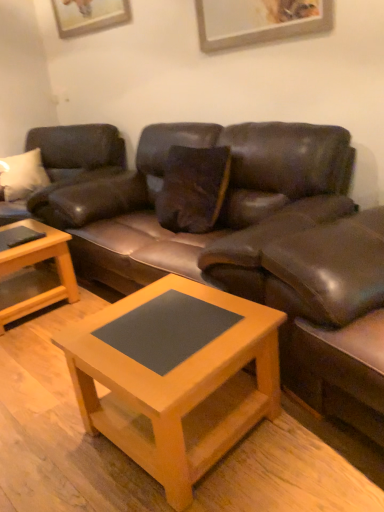
What do you see at coordinates (177, 388) in the screenshot? I see `matte wood coffee table at center, the first coffee table viewed from the right` at bounding box center [177, 388].

Locate an element on the screen. This screenshot has width=384, height=512. leather swivel chair at right is located at coordinates click(333, 317).

Image resolution: width=384 pixels, height=512 pixels. I want to click on matte wood coffee table at center, the second coffee table viewed from the left, so click(x=177, y=388).

From the image's perspective, would you say matte brown leather couch at left, acting as the second studio couch starting from the right, is shown under brown leather couch at center, the 1th studio couch from the right?

Incorrect, from the image's perspective, matte brown leather couch at left, acting as the second studio couch starting from the right, is higher than brown leather couch at center, the 1th studio couch from the right.

The width and height of the screenshot is (384, 512). In order to click on studio couch that appears above the matte brown leather couch at left, acting as the second studio couch starting from the right (from a real-world perspective) in this screenshot , I will do `click(240, 241)`.

Does matte brown leather couch at left, acting as the second studio couch starting from the right, lie behind brown leather couch at center, which appears as the 2th studio couch when viewed from the left?

Yes, matte brown leather couch at left, acting as the second studio couch starting from the right, is behind brown leather couch at center, which appears as the 2th studio couch when viewed from the left.

Are matte brown leather couch at left, acting as the second studio couch starting from the right, and brown leather couch at center, which appears as the 2th studio couch when viewed from the left, far apart?

They are positioned close to each other.

Can you confirm if matte wood coffee table at center, marked as the 1th coffee table in a front-to-back arrangement, is taller than wooden picture frame at upper center?

Indeed, matte wood coffee table at center, marked as the 1th coffee table in a front-to-back arrangement, has a greater height compared to wooden picture frame at upper center.

Is wooden picture frame at upper center at the back of matte wood coffee table at center, the second coffee table viewed from the left?

No, matte wood coffee table at center, the second coffee table viewed from the left, is not facing the opposite direction of wooden picture frame at upper center.

From a real-world perspective, is matte wood coffee table at center, the second coffee table viewed from the left, positioned above or below wooden picture frame at upper center?

matte wood coffee table at center, the second coffee table viewed from the left, is situated lower than wooden picture frame at upper center in the real world.

Is matte wood coffee table at center, the second coffee table from the back, not near wooden picture frame at upper center?

matte wood coffee table at center, the second coffee table from the back, is positioned a significant distance from wooden picture frame at upper center.

Does point (112, 163) appear closer or farther from the camera than point (332, 280)?

Clearly, point (112, 163) is more distant from the camera than point (332, 280).

Between matte brown leather couch at left, which ranks as the 1th studio couch in left-to-right order, and leather swivel chair at right, which one has less height?

leather swivel chair at right.

In terms of width, does matte brown leather couch at left, which ranks as the 1th studio couch in left-to-right order, look wider or thinner when compared to leather swivel chair at right?

Clearly, matte brown leather couch at left, which ranks as the 1th studio couch in left-to-right order, has more width compared to leather swivel chair at right.

From the image's perspective, which one is positioned lower, matte brown leather couch at left, which ranks as the 1th studio couch in left-to-right order, or leather swivel chair at right?

leather swivel chair at right.

Where is `picture frame above the leather swivel chair at right (from a real-world perspective)`? This screenshot has width=384, height=512. picture frame above the leather swivel chair at right (from a real-world perspective) is located at coordinates 89,15.

Is the position of leather swivel chair at right more distant than that of wooden picture frame at upper center?

No, leather swivel chair at right is closer to the camera.

Is leather swivel chair at right positioned beyond the bounds of wooden picture frame at upper center?

Yes, leather swivel chair at right is located beyond the bounds of wooden picture frame at upper center.

Does point (357, 315) lie behind point (74, 33)?

No, it is in front of (74, 33).

Find the location of a particular element. The width and height of the screenshot is (384, 512). studio couch that is the 2nd object above the light brown wooden coffee table at lower left, which is the 1th coffee table from left to right (from a real-world perspective) is located at coordinates (240, 241).

Consider the image. Which of these two, brown leather couch at center, the 1th studio couch from the right, or light brown wooden coffee table at lower left, the 2th coffee table when ordered from right to left, is thinner?

light brown wooden coffee table at lower left, the 2th coffee table when ordered from right to left, is thinner.

From a real-world perspective, which object stands above the other?

wooden picture frame at upper center is physically above.

Is matte wood coffee table at center, the first coffee table viewed from the right, at the back of wooden picture frame at upper center?

No, wooden picture frame at upper center's orientation is not away from matte wood coffee table at center, the first coffee table viewed from the right.

Based on the photo, is wooden picture frame at upper center positioned behind matte wood coffee table at center, the second coffee table viewed from the left?

Yes, wooden picture frame at upper center is further from the camera.

Does matte wood coffee table at center, the second coffee table from the back, have a greater width compared to matte brown leather couch at left, which ranks as the 1th studio couch in left-to-right order?

No.

Which is more to the left, matte wood coffee table at center, the second coffee table from the back, or matte brown leather couch at left, acting as the second studio couch starting from the right?

From the viewer's perspective, matte brown leather couch at left, acting as the second studio couch starting from the right, appears more on the left side.

Is matte wood coffee table at center, the second coffee table from the back, taller or shorter than matte brown leather couch at left, which ranks as the 1th studio couch in left-to-right order?

Considering their sizes, matte wood coffee table at center, the second coffee table from the back, has less height than matte brown leather couch at left, which ranks as the 1th studio couch in left-to-right order.

Identify the location of studio couch behind the brown leather couch at center, which appears as the 2th studio couch when viewed from the left. This screenshot has height=512, width=384. (67, 164).

There is a wooden picture frame at upper center. Where is `the 2nd coffee table below it (from the image's perspective)`? The height and width of the screenshot is (512, 384). the 2nd coffee table below it (from the image's perspective) is located at coordinates (177, 388).

When comparing their distances from leather swivel chair at right, does matte wood coffee table at center, the second coffee table viewed from the left, or brown leather couch at center, which appears as the 2th studio couch when viewed from the left, seem further?

matte wood coffee table at center, the second coffee table viewed from the left.

Based on their spatial positions, is matte brown leather couch at left, acting as the second studio couch starting from the right, or leather swivel chair at right closer to light brown wooden coffee table at lower left, arranged as the second coffee table when viewed from the front?

matte brown leather couch at left, acting as the second studio couch starting from the right.

Looking at the image, which one is located further to matte brown leather couch at left, which ranks as the 1th studio couch in left-to-right order, matte wood coffee table at center, the second coffee table from the back, or wooden picture frame at upper center?

matte wood coffee table at center, the second coffee table from the back.

From the image, which object appears to be nearer to matte brown leather couch at left, which ranks as the 1th studio couch in left-to-right order, wooden picture frame at upper center or leather swivel chair at right?

wooden picture frame at upper center.

Based on their spatial positions, is brown leather couch at center, which appears as the 2th studio couch when viewed from the left, or matte brown leather couch at left, acting as the second studio couch starting from the right, further from wooden picture frame at upper center?

brown leather couch at center, which appears as the 2th studio couch when viewed from the left, is further to wooden picture frame at upper center.

Based on their spatial positions, is leather swivel chair at right or wooden picture frame at upper center further from matte wood coffee table at center, the first coffee table viewed from the right?

Among the two, wooden picture frame at upper center is located further to matte wood coffee table at center, the first coffee table viewed from the right.

Based on their spatial positions, is light brown wooden coffee table at lower left, which appears as the 1th coffee table when viewed from the back, or wooden picture frame at upper center further from brown leather couch at center, the 1th studio couch from the right?

Based on the image, wooden picture frame at upper center appears to be further to brown leather couch at center, the 1th studio couch from the right.

Estimate the real-world distances between objects in this image. Which object is further from leather swivel chair at right, matte brown leather couch at left, acting as the second studio couch starting from the right, or wooden picture frame at upper center?

wooden picture frame at upper center is further to leather swivel chair at right.

Locate an element on the screen. Image resolution: width=384 pixels, height=512 pixels. coffee table between matte wood coffee table at center, the first coffee table viewed from the right, and matte brown leather couch at left, which ranks as the 1th studio couch in left-to-right order, in the front-back direction is located at coordinates (35, 263).

The width and height of the screenshot is (384, 512). Identify the location of swivel chair between wooden picture frame at upper center and matte wood coffee table at center, the first coffee table viewed from the right, vertically. (333, 317).

Locate an element on the screen. coffee table between light brown wooden coffee table at lower left, which appears as the 1th coffee table when viewed from the back, and brown leather couch at center, the 1th studio couch from the right is located at coordinates (177, 388).

Identify the location of studio couch between light brown wooden coffee table at lower left, the 2th coffee table when ordered from right to left, and leather swivel chair at right, in the horizontal direction. (240, 241).